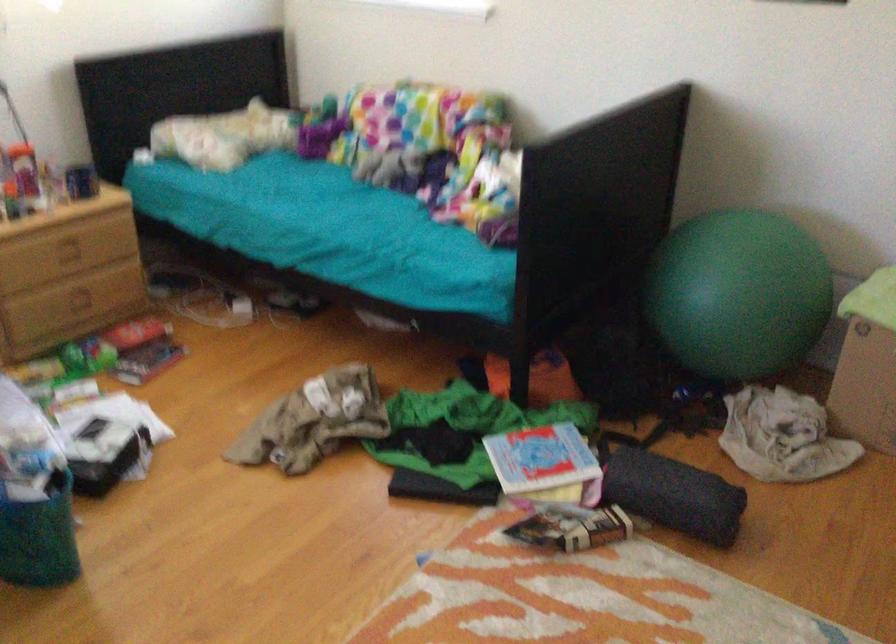
Question: The camera is either moving clockwise (left) or counter-clockwise (right) around the object. The first image is from the beginning of the video and the second image is from the end. Is the camera moving left or right when shooting the video?

Choices:
 (A) Left
 (B) Right

Answer: (B)